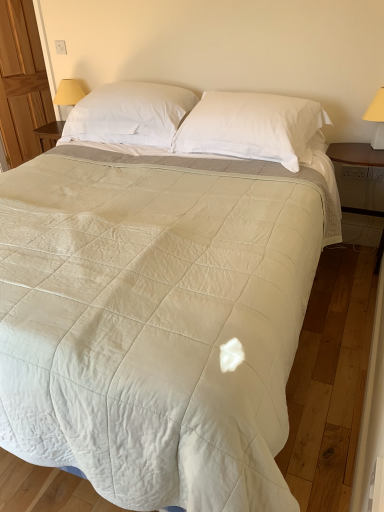
Question: Which is correct: yellow fabric lampshade at right, marked as the 2th table lamp in a left-to-right arrangement, is inside white soft pillow at center, the second pillow positioned from the left, or outside of it?

Choices:
 (A) inside
 (B) outside

Answer: (B)

Question: Is point (377, 95) closer or farther from the camera than point (206, 94)?

Choices:
 (A) closer
 (B) farther

Answer: (A)

Question: Based on their relative distances, which object is nearer to the yellow fabric lampshade at upper left, the first table lamp positioned from the top?

Choices:
 (A) white soft pillow at upper center, which is the first pillow from left to right
 (B) white soft pillow at center, placed as the first pillow when sorted from right to left
 (C) wooden armoire at left
 (D) yellow fabric lampshade at right, which appears as the 2th table lamp when viewed from the top

Answer: (A)

Question: Estimate the real-world distances between objects in this image. Which object is closer to the white soft pillow at upper center, which is the second pillow in right-to-left order?

Choices:
 (A) yellow fabric lampshade at right, which appears as the 2th table lamp when viewed from the top
 (B) wooden armoire at left
 (C) yellow fabric lampshade at upper left, which is the 2th table lamp in bottom-to-top order
 (D) white soft pillow at center, the second pillow positioned from the left

Answer: (D)